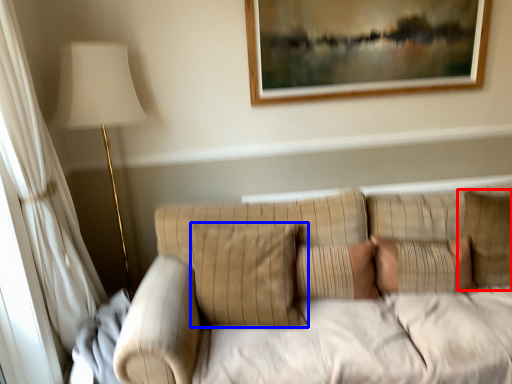
Question: Which object is closer to the camera taking this photo, pillow (highlighted by a red box) or pillow (highlighted by a blue box)?

Choices:
 (A) pillow
 (B) pillow

Answer: (B)